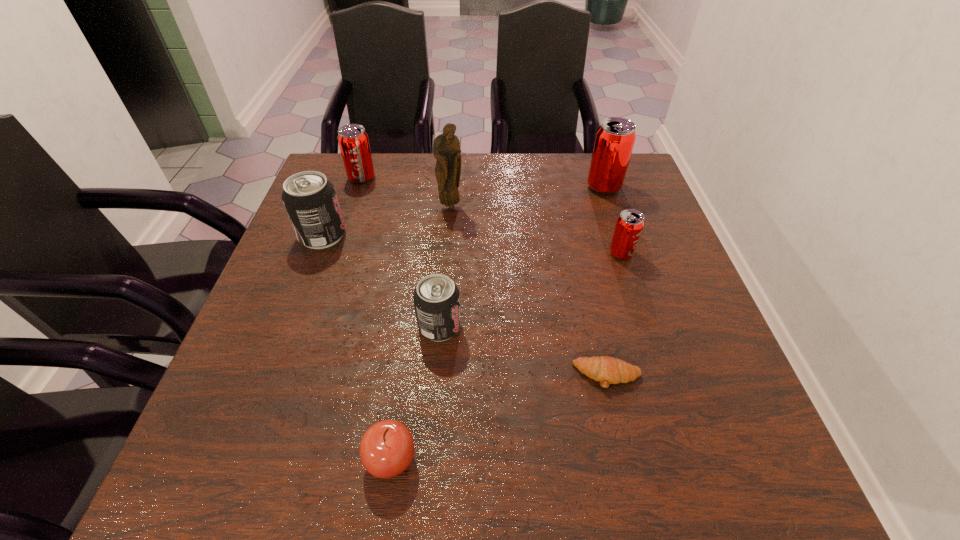
What are the coordinates of `the seventh tallest object` in the screenshot? It's located at (387, 448).

At what (x,y) coordinates should I click in order to perform the action: click on the nearest object. Please return your answer as a coordinate pair (x, y). The width and height of the screenshot is (960, 540). Looking at the image, I should click on (387, 448).

Locate an element on the screen. Image resolution: width=960 pixels, height=540 pixels. the shortest object is located at coordinates (607, 370).

At what (x,y) coordinates should I click in order to perform the action: click on the second nearest object. Please return your answer as a coordinate pair (x, y). This screenshot has height=540, width=960. Looking at the image, I should click on (607, 370).

Identify the location of free space located 0.210m on the front-facing side of the figurine. The width and height of the screenshot is (960, 540). (446, 266).

Locate an element on the screen. The width and height of the screenshot is (960, 540). free region located on the left of the tallest soda can is located at coordinates (491, 187).

Find the location of `free space located on the right of the leftmost red soda can`. free space located on the right of the leftmost red soda can is located at coordinates (420, 178).

Identify the location of vacant position located 0.190m on the front of the bigger black soda can. This screenshot has width=960, height=540. (293, 313).

Where is `vacant area located 0.390m on the left of the smallest red soda can`? vacant area located 0.390m on the left of the smallest red soda can is located at coordinates (445, 253).

Where is `free spot located on the back of the nearest soda can`? The image size is (960, 540). free spot located on the back of the nearest soda can is located at coordinates (445, 255).